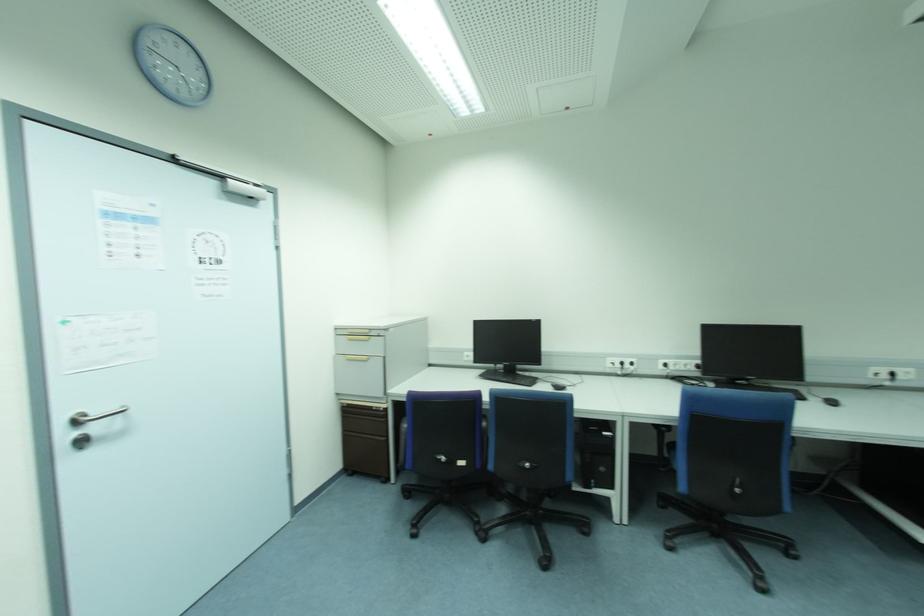
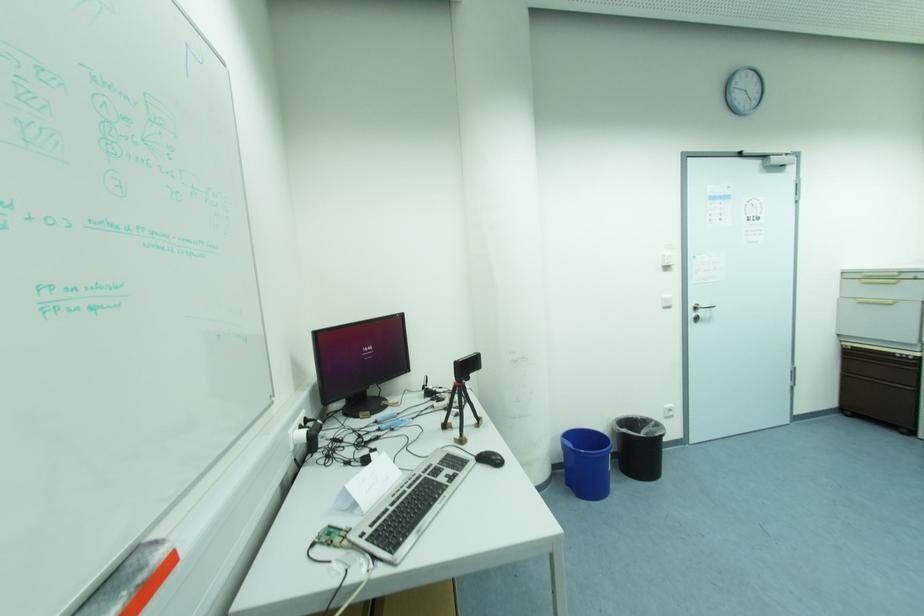
In the second image, find the point that corresponds to (x=383, y=439) in the first image.

(910, 387)